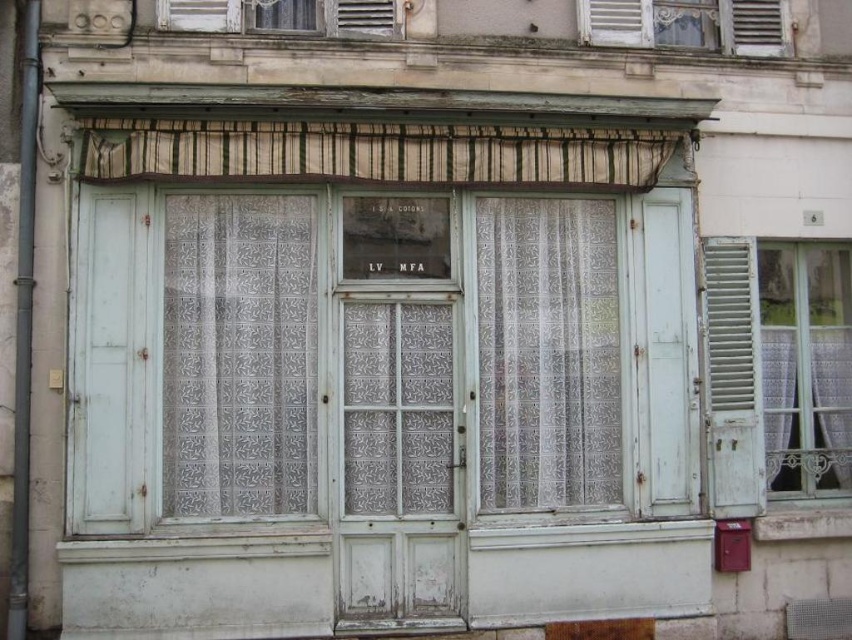
Question: Is striped fabric curtain at upper center to the right of white painted wood at upper right from the viewer's perspective?

Choices:
 (A) yes
 (B) no

Answer: (B)

Question: Which object is the farthest from the white painted wood at upper right?

Choices:
 (A) white painted wood at right
 (B) white wooden shutters at upper center
 (C) white lace curtain at center
 (D) striped fabric curtain at upper center

Answer: (B)

Question: Considering the relative positions of white lace curtain at center and white painted wood at right in the image provided, where is white lace curtain at center located with respect to white painted wood at right?

Choices:
 (A) left
 (B) right

Answer: (A)

Question: Is white lace curtain at left above white lace curtain at center?

Choices:
 (A) no
 (B) yes

Answer: (B)

Question: Which is nearer to the white painted wood at upper right?

Choices:
 (A) white lace curtain at center
 (B) white wooden shutters at upper center
 (C) white painted wood at right

Answer: (C)

Question: Which of the following is the closest to the observer?

Choices:
 (A) white lace curtain at center
 (B) white painted wood at upper right

Answer: (A)